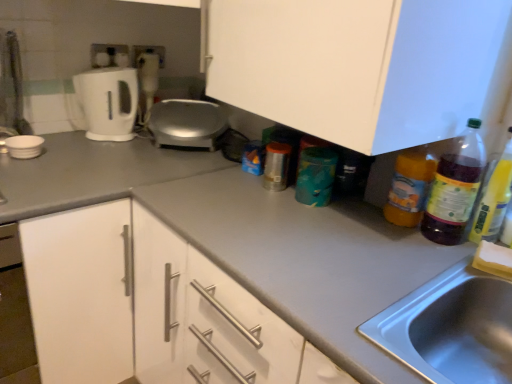
Where is `vacant space that is to the left of satin silver appliance at center, placed as the second appliance when sorted from left to right`? vacant space that is to the left of satin silver appliance at center, placed as the second appliance when sorted from left to right is located at coordinates (110, 144).